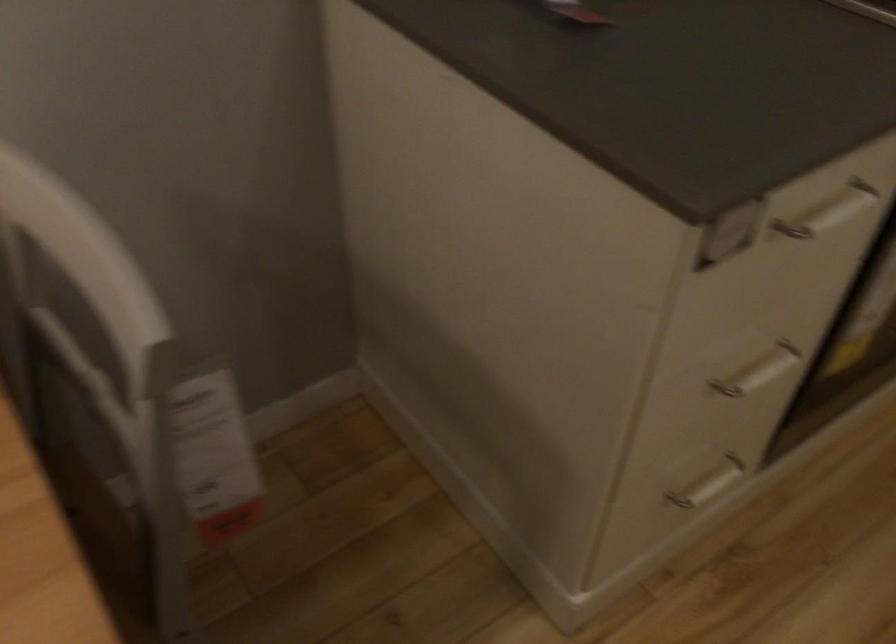
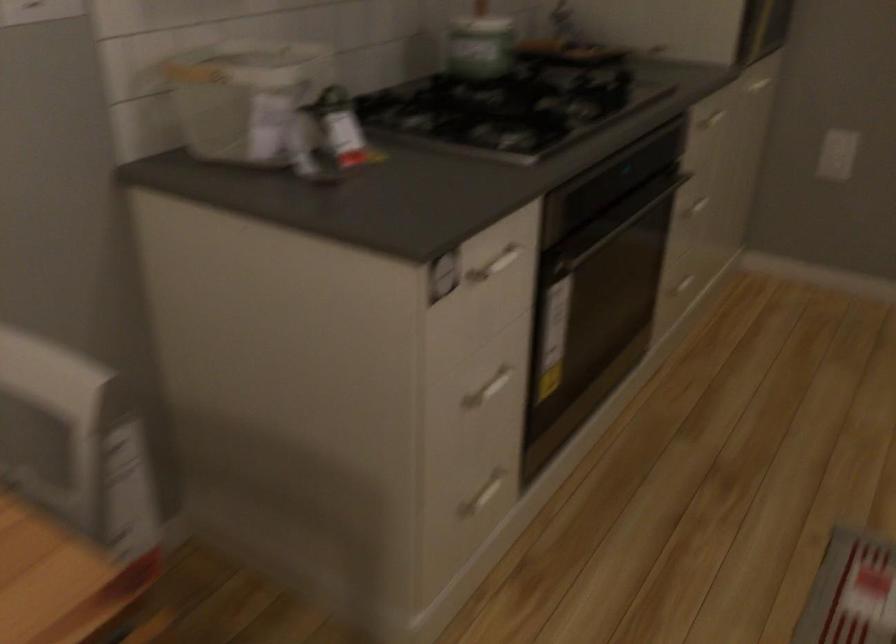
Find the pixel in the second image that matches pixel 750 368 in the first image.

(487, 389)